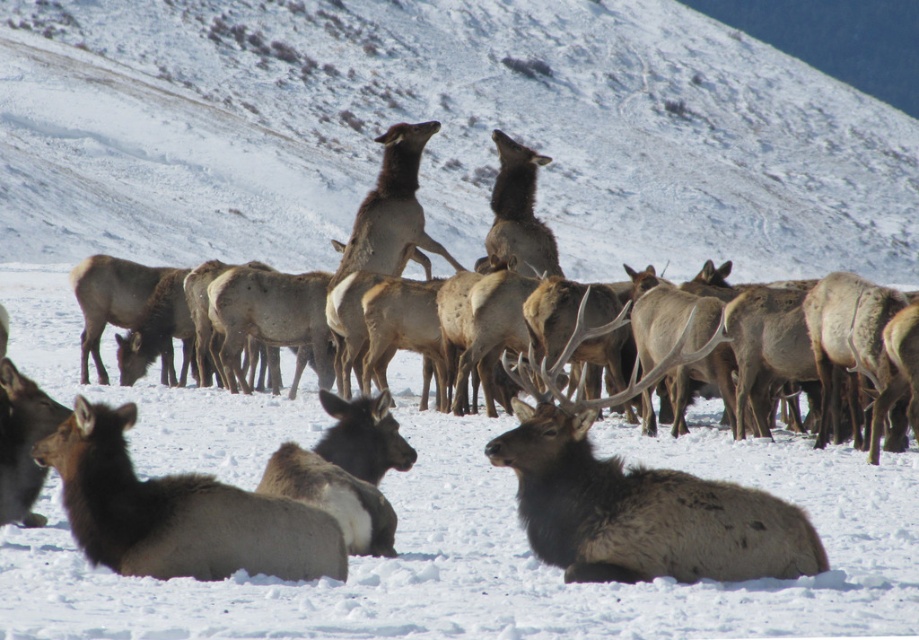
You are an animal tracker observing the elk in the snowy landscape. You notice the brown velvet antlers at upper center and the brown fuzzy deer at lower left. Which object is located to the right of the other?

The brown velvet antlers at upper center is positioned on the right side of brown fuzzy deer at lower left, so the brown velvet antlers at upper center is to the right of the brown fuzzy deer at lower left.

In the snowy landscape, you notice the snowy white hillside at upper center and the brown fuzzy deer at lower left. Which of these two objects takes up more space in the image?

The snowy white hillside at upper center takes up more space in the image compared to the brown fuzzy deer at lower left because it has a larger size.

You are an animal researcher observing the elk in the snowy landscape. You notice the brown velvet antlers at upper center and the brown fuzzy deer at lower left. Which of these two objects is bigger in size?

The brown velvet antlers at upper center is larger in size than the brown fuzzy deer at lower left.